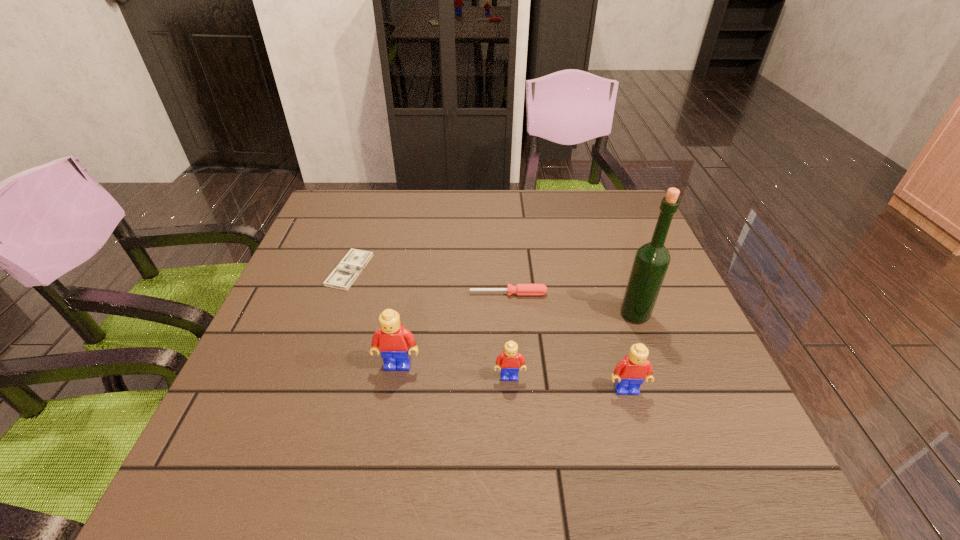
At what (x,y) coordinates should I click in order to perform the action: click on free area in between the shortest object and the leftmost Lego. Please return your answer as a coordinate pair (x, y). Looking at the image, I should click on (374, 318).

Where is `free spot between the shortest object and the third shortest object`? This screenshot has width=960, height=540. free spot between the shortest object and the third shortest object is located at coordinates (429, 323).

Where is `free space between the screwdriver and the tallest Lego`? free space between the screwdriver and the tallest Lego is located at coordinates (453, 329).

Where is `vacant area between the liquor and the screwdriver`? vacant area between the liquor and the screwdriver is located at coordinates (572, 304).

Find the location of a particular element. Image resolution: width=960 pixels, height=540 pixels. unoccupied area between the dollar and the leftmost Lego is located at coordinates (374, 318).

At what (x,y) coordinates should I click in order to perform the action: click on unoccupied position between the third farthest object and the shortest Lego. Please return your answer as a coordinate pair (x, y). Looking at the image, I should click on 572,346.

Where is `free space between the leftmost object and the nearest Lego`? The width and height of the screenshot is (960, 540). free space between the leftmost object and the nearest Lego is located at coordinates (488, 329).

You are a GUI agent. You are given a task and a screenshot of the screen. Output one action in this format:
    pyautogui.click(x=<x>, y=<y>)
    Task: Click on the vacant point located between the shortest object and the second object from left to right
    
    Given the screenshot: What is the action you would take?
    coord(374,318)

Identify which object is the fourth nearest to the shortest Lego. Please provide its 2D coordinates. Your answer should be formatted as a tuple, i.e. [(x, y)], where the tuple contains the x and y coordinates of a point satisfying the conditions above.

[(652, 259)]

Where is `object that is the fifth closest to the shortest object`? The width and height of the screenshot is (960, 540). object that is the fifth closest to the shortest object is located at coordinates (652, 259).